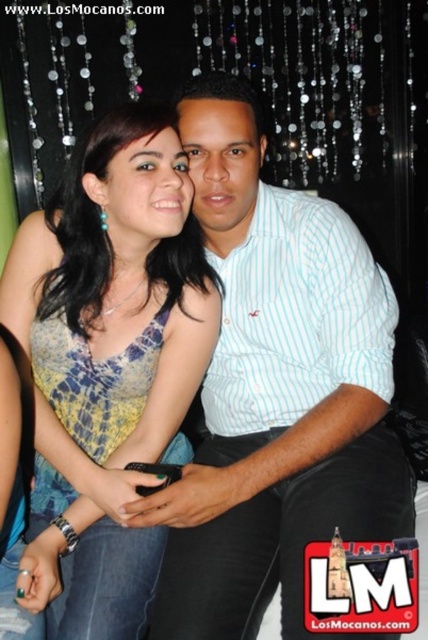
You are a photographer trying to adjust the lighting for a photo shoot. You notice two subjects in the frame wearing a white striped shirt at center and a printed fabric dress at center. Which clothing item should you focus on first if you want to ensure proper exposure for the lighter colored clothing?

The white striped shirt at center should be focused on first because it is lighter in color than the printed fabric dress at center, requiring proper exposure to avoid overexposure.

You are a photographer trying to frame a portrait of the two subjects in the image. Given that the white striped shirt at center and the printed fabric dress at center are both in the center, which one should you focus on to ensure the taller subject is properly captured?

The white striped shirt at center is taller than the printed fabric dress at center, so focusing on the white striped shirt at center will ensure the taller subject is properly captured.